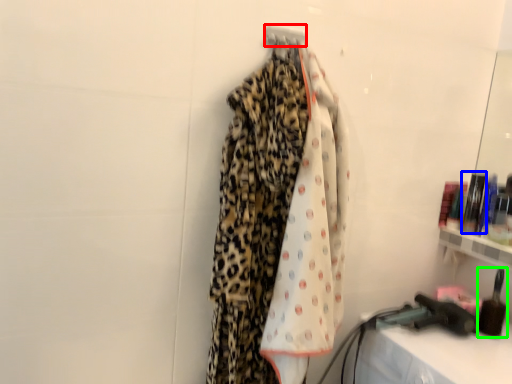
Question: Which is nearer to the hanger (highlighted by a red box)? toiletry (highlighted by a blue box) or toiletry (highlighted by a green box).

Choices:
 (A) toiletry
 (B) toiletry

Answer: (A)